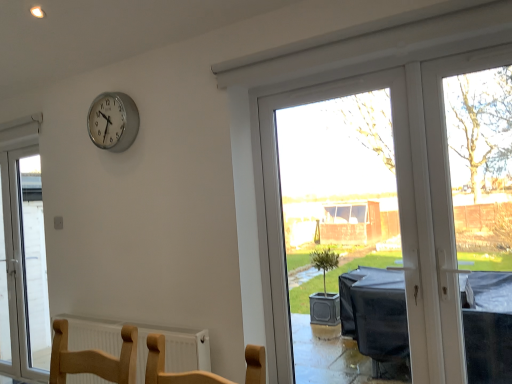
Describe the element at coordinates (113, 121) in the screenshot. I see `silver metallic clock at upper left` at that location.

The height and width of the screenshot is (384, 512). Describe the element at coordinates (23, 268) in the screenshot. I see `white glass door at left, the second window from the right` at that location.

The image size is (512, 384). Identify the location of transparent plastic window at center, the second window from the left. (393, 217).

Describe the element at coordinates (393, 217) in the screenshot. This screenshot has width=512, height=384. I see `transparent plastic window at center, acting as the 1th window starting from the right` at that location.

This screenshot has height=384, width=512. What are the coordinates of `silver metallic clock at upper left` in the screenshot? It's located at (113, 121).

From a real-world perspective, who is located higher, silver metallic clock at upper left or white textured radiator at lower center?

From a 3D spatial view, silver metallic clock at upper left is above.

Considering the relative sizes of silver metallic clock at upper left and white textured radiator at lower center in the image provided, is silver metallic clock at upper left bigger than white textured radiator at lower center?

No.

Identify the location of wall clock above the white textured radiator at lower center (from a real-world perspective). (113, 121).

Does silver metallic clock at upper left contain white textured radiator at lower center?

No, white textured radiator at lower center is not inside silver metallic clock at upper left.

This screenshot has height=384, width=512. I want to click on wall clock in front of the white glass door at left, which is counted as the first window, starting from the back, so click(113, 121).

Are silver metallic clock at upper left and white glass door at left, which is counted as the first window, starting from the back, making contact?

No, silver metallic clock at upper left is not in contact with white glass door at left, which is counted as the first window, starting from the back.

Considering the relative sizes of silver metallic clock at upper left and white glass door at left, which is counted as the first window, starting from the back, in the image provided, is silver metallic clock at upper left smaller than white glass door at left, which is counted as the first window, starting from the back,?

Yes, silver metallic clock at upper left is smaller than white glass door at left, which is counted as the first window, starting from the back.

From the picture: From a real-world perspective, is silver metallic clock at upper left positioned above or below white glass door at left, which is counted as the first window, starting from the back?

silver metallic clock at upper left is above white glass door at left, which is counted as the first window, starting from the back.

Is silver metallic clock at upper left in front of transparent plastic window at center, which appears as the 1th window when viewed from the front?

That is False.

Between point (114, 146) and point (493, 202), which one is positioned in front?

The point (114, 146) is more forward.

Is silver metallic clock at upper left wider than transparent plastic window at center, acting as the 1th window starting from the right?

Yes, silver metallic clock at upper left is wider than transparent plastic window at center, acting as the 1th window starting from the right.

There is a white textured radiator at lower center. Where is `the 1st window above it (from a real-world perspective)`? The image size is (512, 384). the 1st window above it (from a real-world perspective) is located at coordinates (23, 268).

Is there a large distance between white glass door at left, acting as the second window starting from the front, and white textured radiator at lower center?

Indeed, white glass door at left, acting as the second window starting from the front, is not near white textured radiator at lower center.

Which is less distant, (42,331) or (209,344)?

Point (42,331).

What's the angular difference between white glass door at left, the second window from the right, and white textured radiator at lower center's facing directions?

The facing directions of white glass door at left, the second window from the right, and white textured radiator at lower center are 0.011 degrees apart.

From the image's perspective, is white glass door at left, which is counted as the first window, starting from the back, under transparent plastic window at center, acting as the 1th window starting from the right?

Yes, from the image's perspective, white glass door at left, which is counted as the first window, starting from the back, is below transparent plastic window at center, acting as the 1th window starting from the right.

Would you say white glass door at left, arranged as the 1th window when viewed from the left, is outside transparent plastic window at center, the second window from the left?

Yes, white glass door at left, arranged as the 1th window when viewed from the left, is outside of transparent plastic window at center, the second window from the left.

Image resolution: width=512 pixels, height=384 pixels. What are the coordinates of `window above the white glass door at left, which is counted as the first window, starting from the back (from a real-world perspective)` in the screenshot? It's located at (393, 217).

Does white glass door at left, which is counted as the first window, starting from the back, turn towards transparent plastic window at center, acting as the 1th window starting from the right?

No, white glass door at left, which is counted as the first window, starting from the back, is not oriented towards transparent plastic window at center, acting as the 1th window starting from the right.

Can you confirm if white textured radiator at lower center is smaller than silver metallic clock at upper left?

No, white textured radiator at lower center is not smaller than silver metallic clock at upper left.

Is point (208, 346) positioned behind point (92, 124)?

No, (208, 346) is closer to viewer.

Which object is closer to the camera, white textured radiator at lower center or silver metallic clock at upper left?

white textured radiator at lower center.

From the image's perspective, which one is positioned higher, white textured radiator at lower center or silver metallic clock at upper left?

silver metallic clock at upper left, from the image's perspective.

Considering the relative sizes of white textured radiator at lower center and transparent plastic window at center, the second window viewed from the back, in the image provided, is white textured radiator at lower center thinner than transparent plastic window at center, the second window viewed from the back,?

In fact, white textured radiator at lower center might be wider than transparent plastic window at center, the second window viewed from the back.

Measure the distance between white textured radiator at lower center and transparent plastic window at center, the second window from the left.

white textured radiator at lower center is 3.14 meters from transparent plastic window at center, the second window from the left.

In the image, is white textured radiator at lower center on the left side or the right side of transparent plastic window at center, which appears as the 1th window when viewed from the front?

Based on their positions, white textured radiator at lower center is located to the left of transparent plastic window at center, which appears as the 1th window when viewed from the front.

Is white textured radiator at lower center situated inside transparent plastic window at center, the second window from the left, or outside?

white textured radiator at lower center is not enclosed by transparent plastic window at center, the second window from the left.

Find the location of a particular element. Image resolution: width=512 pixels, height=384 pixels. wall clock above the white textured radiator at lower center (from a real-world perspective) is located at coordinates (113, 121).

Identify the location of wall clock located on the right of white glass door at left, arranged as the 1th window when viewed from the left. click(113, 121).

Based on their spatial positions, is white textured radiator at lower center or transparent plastic window at center, which appears as the 1th window when viewed from the front, closer to silver metallic clock at upper left?

white textured radiator at lower center.

Looking at the image, which one is located further to white glass door at left, arranged as the 1th window when viewed from the left, silver metallic clock at upper left or white textured radiator at lower center?

silver metallic clock at upper left lies further to white glass door at left, arranged as the 1th window when viewed from the left, than the other object.

When comparing their distances from silver metallic clock at upper left, does white glass door at left, which is counted as the first window, starting from the back, or transparent plastic window at center, which appears as the 1th window when viewed from the front, seem closer?

white glass door at left, which is counted as the first window, starting from the back, lies closer to silver metallic clock at upper left than the other object.

Estimate the real-world distances between objects in this image. Which object is further from transparent plastic window at center, the second window viewed from the back, silver metallic clock at upper left or white textured radiator at lower center?

white textured radiator at lower center is further to transparent plastic window at center, the second window viewed from the back.

Based on the photo, estimate the real-world distances between objects in this image. Which object is further from white glass door at left, arranged as the 1th window when viewed from the left, white textured radiator at lower center or silver metallic clock at upper left?

silver metallic clock at upper left is further to white glass door at left, arranged as the 1th window when viewed from the left.

Which object lies further to the anchor point white textured radiator at lower center, silver metallic clock at upper left or white glass door at left, arranged as the 1th window when viewed from the left?

Among the two, white glass door at left, arranged as the 1th window when viewed from the left, is located further to white textured radiator at lower center.

Based on their spatial positions, is white textured radiator at lower center or white glass door at left, which is counted as the first window, starting from the back, further from transparent plastic window at center, acting as the 1th window starting from the right?

white textured radiator at lower center is positioned further to the anchor transparent plastic window at center, acting as the 1th window starting from the right.

Estimate the real-world distances between objects in this image. Which object is closer to white textured radiator at lower center, white glass door at left, acting as the second window starting from the front, or transparent plastic window at center, the second window from the left?

white glass door at left, acting as the second window starting from the front, lies closer to white textured radiator at lower center than the other object.

The image size is (512, 384). I want to click on radiator between silver metallic clock at upper left and transparent plastic window at center, which appears as the 1th window when viewed from the front, so click(174, 350).

This screenshot has height=384, width=512. In order to click on wall clock between white glass door at left, which is counted as the first window, starting from the back, and transparent plastic window at center, acting as the 1th window starting from the right, from left to right in this screenshot , I will do `click(113, 121)`.

Find the location of a particular element. The height and width of the screenshot is (384, 512). radiator situated between white glass door at left, which is counted as the first window, starting from the back, and transparent plastic window at center, which appears as the 1th window when viewed from the front, from left to right is located at coordinates (174, 350).